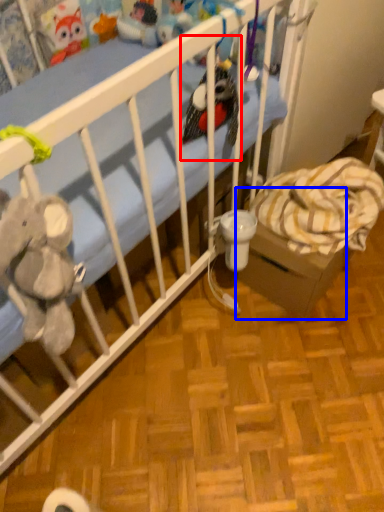
Question: Which object is further to the camera taking this photo, toy (highlighted by a red box) or cardboard box (highlighted by a blue box)?

Choices:
 (A) toy
 (B) cardboard box

Answer: (B)